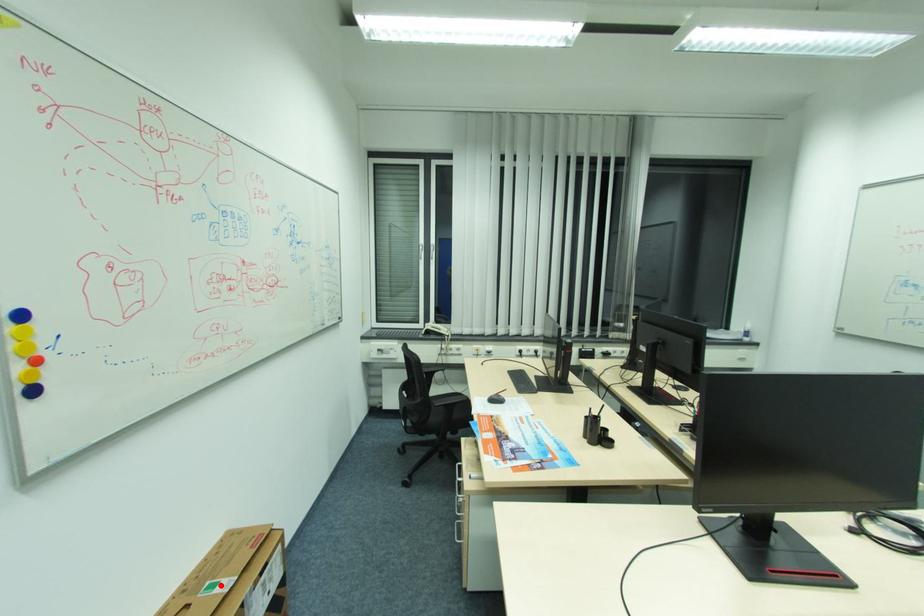
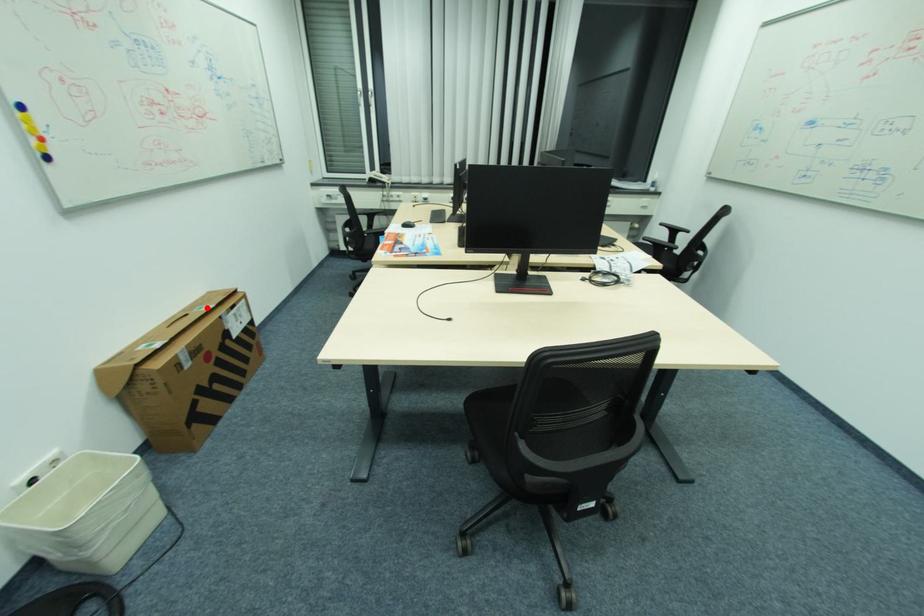
I am providing you with two images of the same scene from different viewpoints. A red point is marked on the first image and another point is marked on the second image. Is the marked point in image1 the same physical position as the marked point in image2?

Yes